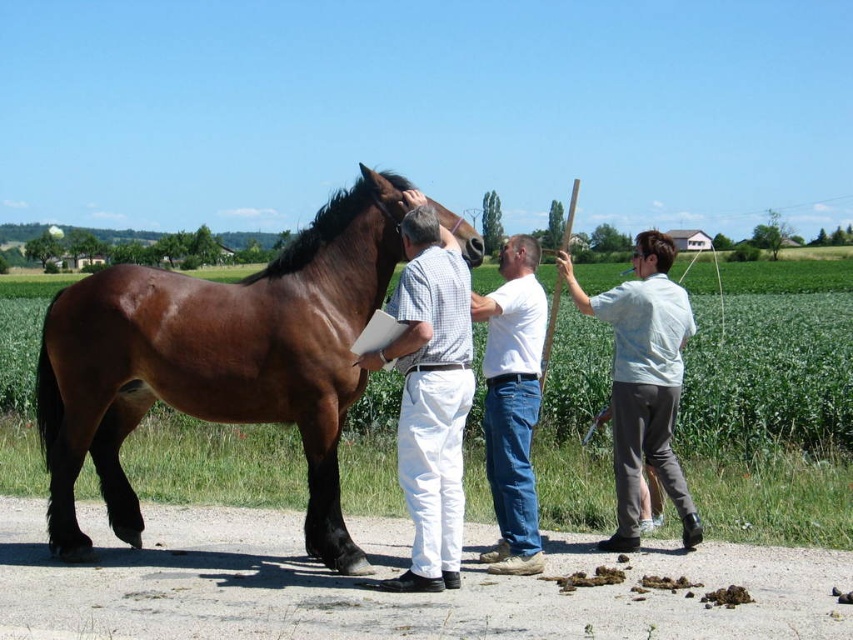
Measure the distance between white cotton pants at center and camera.

They are 16.98 feet apart.

Is white cotton pants at center to the right of light blue shirt at right from the viewer's perspective?

No, white cotton pants at center is not to the right of light blue shirt at right.

Locate an element on the screen. white cotton pants at center is located at coordinates (430, 394).

Does light blue shirt at right appear over white cotton shirt at center?

Yes, light blue shirt at right is above white cotton shirt at center.

Is point (619, 422) in front of point (505, 275)?

No, it is behind (505, 275).

Measure the distance between point (646, 275) and camera.

Point (646, 275) is 6.12 meters from camera.

In order to click on light blue shirt at right in this screenshot , I will do `click(643, 380)`.

Does point (155, 371) lie in front of point (453, 557)?

No, (155, 371) is further to viewer.

Which of these two, brown glossy horse at center or white cotton pants at center, stands taller?

With more height is brown glossy horse at center.

Is point (143, 365) closer to viewer compared to point (437, 374)?

No.

This screenshot has height=640, width=853. I want to click on brown glossy horse at center, so click(x=219, y=362).